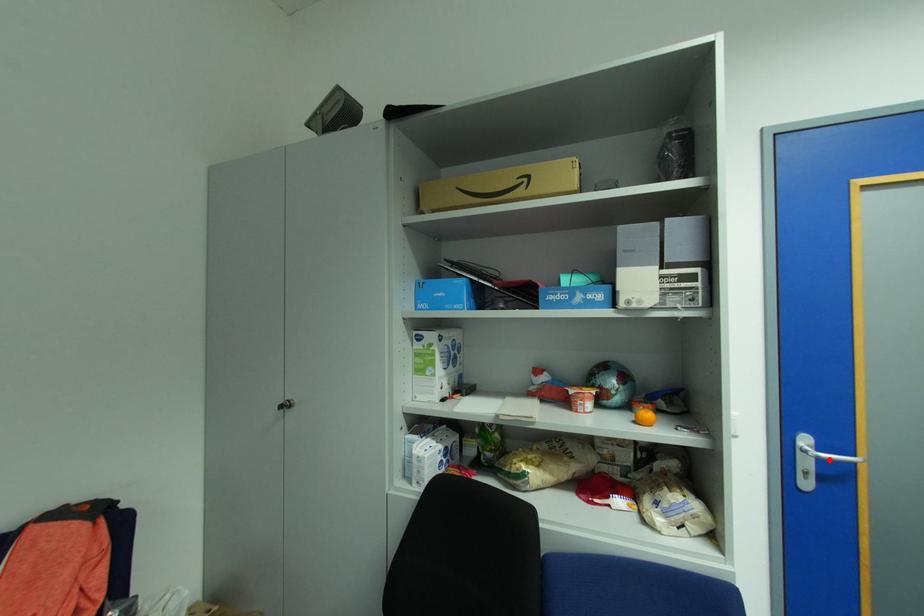
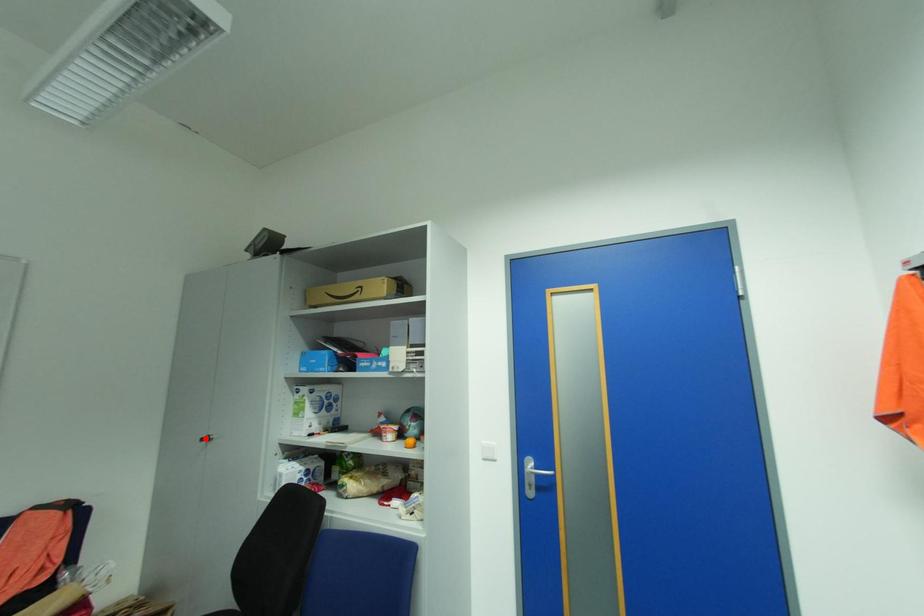
I am providing you with two images of the same scene from different viewpoints. A red point is marked on the first image and another point is marked on the second image. Are the points marked in image1 and image2 representing the same 3D position?

No